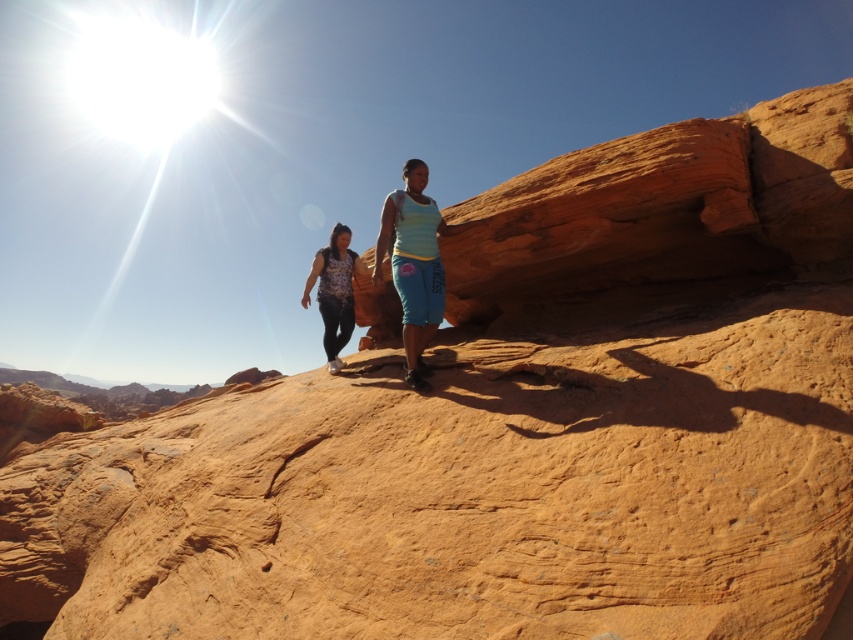
You are a photographer trying to capture the two hikers in the image. Since the light blue denim shorts at center and the matte floral shirt at center are both at the center, which one appears taller in the photo?

The light blue denim shorts at center is taller than the matte floral shirt at center, so it appears taller in the photo.